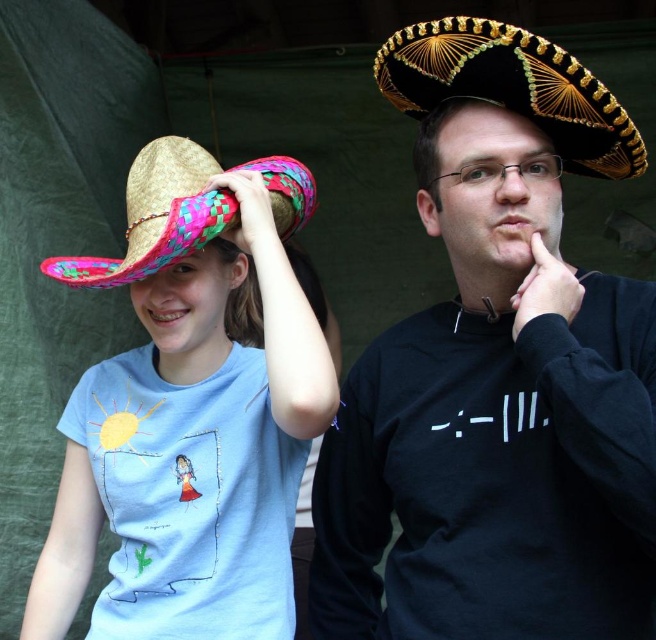
Question: Is the position of black straw sombrero at upper right more distant than that of bright pink woven straw cowboy hat at upper left?

Choices:
 (A) no
 (B) yes

Answer: (A)

Question: Which object appears farthest from the camera in this image?

Choices:
 (A) bright straw hat at left
 (B) bright pink woven straw cowboy hat at upper left
 (C) black straw sombrero at upper right

Answer: (B)

Question: Based on their relative distances, which object is farther from the black matte sombrero at center?

Choices:
 (A) black straw sombrero at upper right
 (B) bright pink woven straw cowboy hat at upper left
 (C) bright straw hat at left

Answer: (B)

Question: Based on their relative distances, which object is farther from the black matte sombrero at center?

Choices:
 (A) bright straw hat at left
 (B) black straw sombrero at upper right
 (C) bright pink woven straw cowboy hat at upper left

Answer: (C)

Question: Observing the image, what is the correct spatial positioning of black matte sombrero at center in reference to bright pink woven straw cowboy hat at upper left?

Choices:
 (A) above
 (B) below

Answer: (B)

Question: Does black straw sombrero at upper right appear over bright pink woven straw cowboy hat at upper left?

Choices:
 (A) no
 (B) yes

Answer: (B)